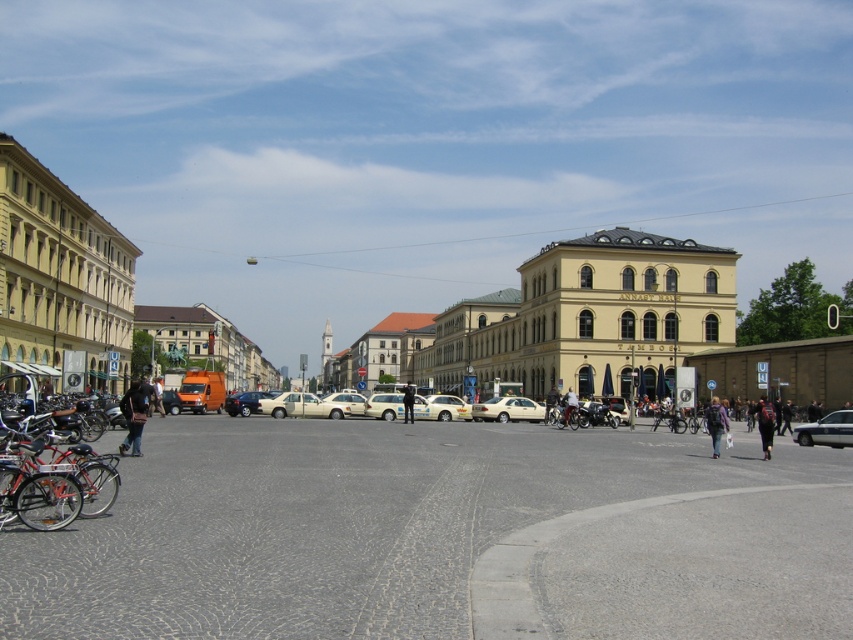
Can you confirm if denim jacket at lower right is taller than shiny silver bicycle at center?

Yes.

Who is lower down, denim jacket at lower right or shiny silver bicycle at center?

Positioned lower is shiny silver bicycle at center.

The width and height of the screenshot is (853, 640). What are the coordinates of `denim jacket at lower right` in the screenshot? It's located at (715, 422).

Can you confirm if metallic silver car at center is positioned to the right of shiny silver bicycle at center?

Incorrect, metallic silver car at center is not on the right side of shiny silver bicycle at center.

Is the position of metallic silver car at center less distant than that of shiny silver bicycle at center?

No.

Where is `metallic silver car at center`? Image resolution: width=853 pixels, height=640 pixels. metallic silver car at center is located at coordinates (244, 403).

At what (x,y) coordinates should I click in order to perform the action: click on metallic silver car at center. Please return your answer as a coordinate pair (x, y). This screenshot has width=853, height=640. Looking at the image, I should click on (244, 403).

Does silver metallic sedan at lower right have a greater height compared to shiny silver bicycle at center?

No.

In the scene shown: Does silver metallic sedan at lower right have a greater width compared to shiny silver bicycle at center?

No.

Which is in front, point (801, 433) or point (657, 417)?

Positioned in front is point (801, 433).

This screenshot has width=853, height=640. What are the coordinates of `silver metallic sedan at lower right` in the screenshot? It's located at (827, 429).